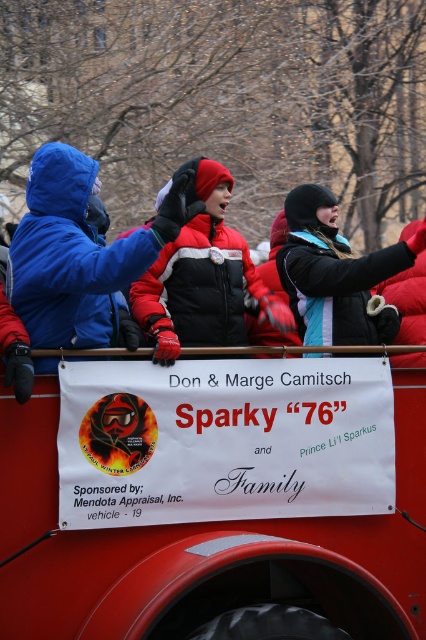
What is the exact position of the blue fleece jacket at left in the image?

The blue fleece jacket at left is located at point (83, 253).

Looking at this image, where is the matte blue jacket at left located in the image?

The matte blue jacket at left is located at point (78, 252).